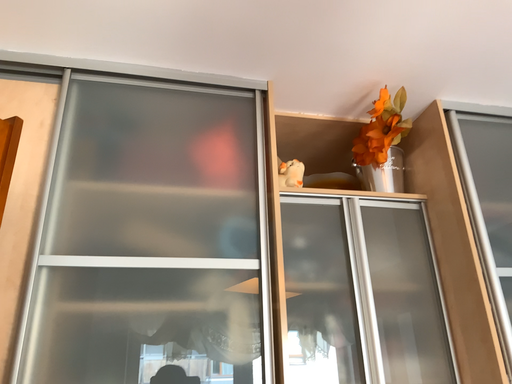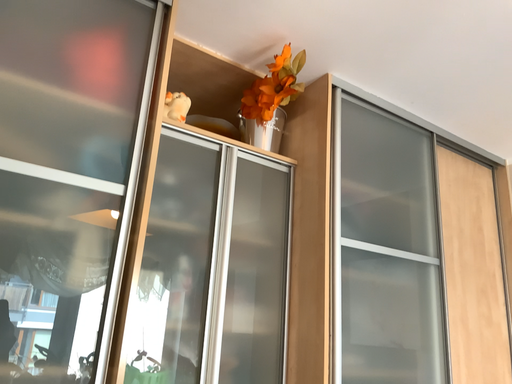
Question: Which way did the camera rotate in the video?

Choices:
 (A) rotated right
 (B) rotated left

Answer: (A)